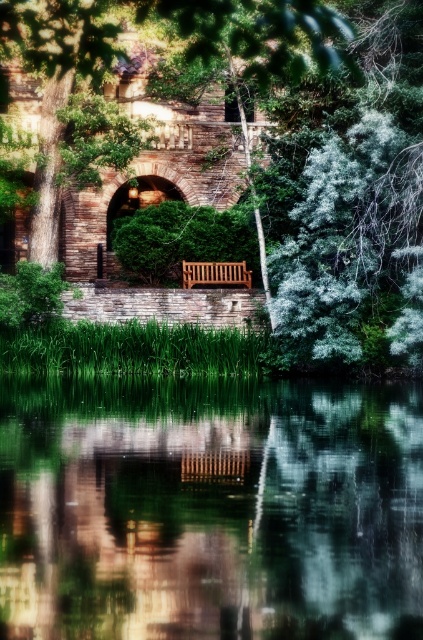
Question: Which point is farther from the camera taking this photo?

Choices:
 (A) (184, 280)
 (B) (203, 552)
 (C) (299, 108)

Answer: (A)

Question: Does green reflective water at center have a greater width compared to teak wood bench at center?

Choices:
 (A) no
 (B) yes

Answer: (B)

Question: Is green reflective water at center bigger than green leafy tree at center?

Choices:
 (A) no
 (B) yes

Answer: (A)

Question: Which of the following is the farthest from the observer?

Choices:
 (A) (321, 32)
 (B) (321, 593)
 (C) (195, 284)

Answer: (C)

Question: Among these objects, which one is nearest to the camera?

Choices:
 (A) teak wood bench at center
 (B) green reflective water at center

Answer: (B)

Question: Does green reflective water at center appear over teak wood bench at center?

Choices:
 (A) yes
 (B) no

Answer: (B)